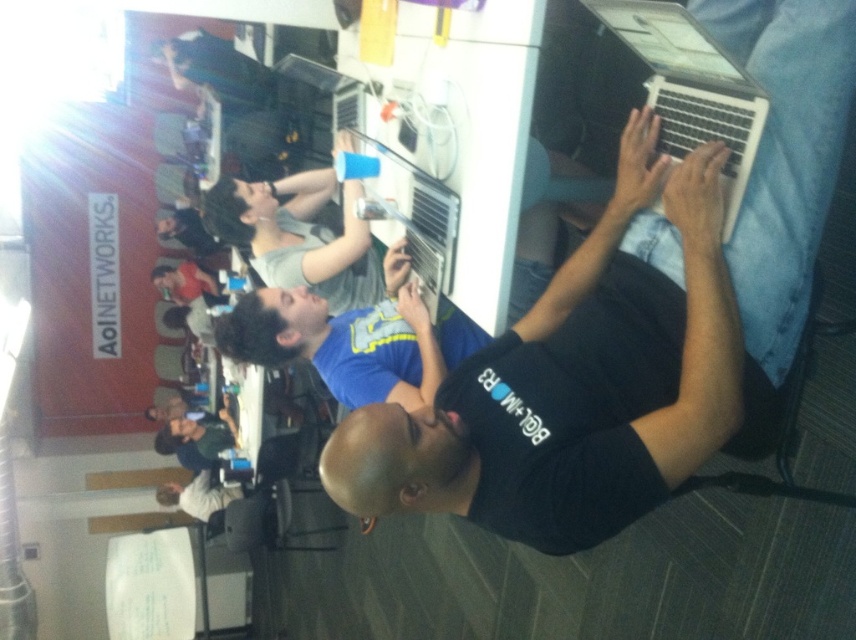
Consider the image. Which is more to the right, gray matte shirt at upper center or matte black shirt at upper center?

Positioned to the right is gray matte shirt at upper center.

Is gray matte shirt at upper center taller than matte black shirt at upper center?

Correct, gray matte shirt at upper center is much taller as matte black shirt at upper center.

Who is more forward, (352, 301) or (152, 273)?

Point (352, 301) is in front.

Find the location of a particular element. Image resolution: width=856 pixels, height=640 pixels. gray matte shirt at upper center is located at coordinates (299, 236).

Between point (721, 84) and point (305, 193), which one is positioned behind?

The point (305, 193) is behind.

Between silver metallic laptop at upper right and gray matte shirt at upper center, which one appears on the right side from the viewer's perspective?

silver metallic laptop at upper right is more to the right.

Which is behind, point (685, 84) or point (325, 237)?

The point (325, 237) is more distant.

The height and width of the screenshot is (640, 856). In order to click on silver metallic laptop at upper right in this screenshot , I will do `click(691, 88)`.

What do you see at coordinates (299, 236) in the screenshot?
I see `gray matte shirt at upper center` at bounding box center [299, 236].

Find the location of a particular element. gray matte shirt at upper center is located at coordinates (299, 236).